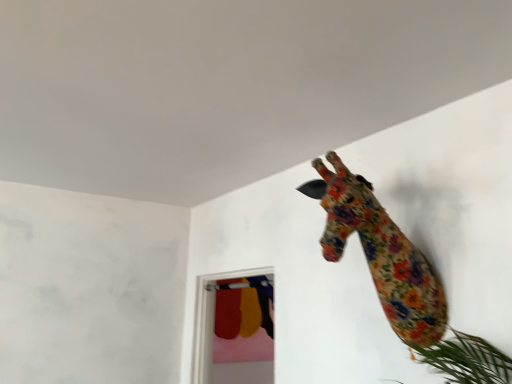
Question: Are transparent glass door at center and floral fabric giraffe at upper right making contact?

Choices:
 (A) yes
 (B) no

Answer: (B)

Question: From the image's perspective, is transparent glass door at center located above floral fabric giraffe at upper right?

Choices:
 (A) yes
 (B) no

Answer: (B)

Question: From a real-world perspective, is transparent glass door at center beneath floral fabric giraffe at upper right?

Choices:
 (A) yes
 (B) no

Answer: (A)

Question: Is transparent glass door at center thinner than floral fabric giraffe at upper right?

Choices:
 (A) yes
 (B) no

Answer: (A)

Question: Considering the relative sizes of transparent glass door at center and floral fabric giraffe at upper right in the image provided, is transparent glass door at center bigger than floral fabric giraffe at upper right?

Choices:
 (A) yes
 (B) no

Answer: (A)

Question: Is transparent glass door at center aimed at floral fabric giraffe at upper right?

Choices:
 (A) no
 (B) yes

Answer: (A)

Question: Considering the relative positions of floral fabric giraffe at upper right and transparent glass door at center in the image provided, is floral fabric giraffe at upper right to the left of transparent glass door at center from the viewer's perspective?

Choices:
 (A) no
 (B) yes

Answer: (A)

Question: Considering the relative positions of floral fabric giraffe at upper right and transparent glass door at center in the image provided, is floral fabric giraffe at upper right in front of transparent glass door at center?

Choices:
 (A) no
 (B) yes

Answer: (B)

Question: Is floral fabric giraffe at upper right shorter than transparent glass door at center?

Choices:
 (A) no
 (B) yes

Answer: (B)

Question: From the image's perspective, would you say floral fabric giraffe at upper right is shown under transparent glass door at center?

Choices:
 (A) yes
 (B) no

Answer: (B)

Question: From a real-world perspective, is floral fabric giraffe at upper right beneath transparent glass door at center?

Choices:
 (A) yes
 (B) no

Answer: (B)

Question: Is transparent glass door at center a part of floral fabric giraffe at upper right?

Choices:
 (A) yes
 (B) no

Answer: (B)

Question: Would you say transparent glass door at center is to the left or to the right of floral fabric giraffe at upper right in the picture?

Choices:
 (A) right
 (B) left

Answer: (B)